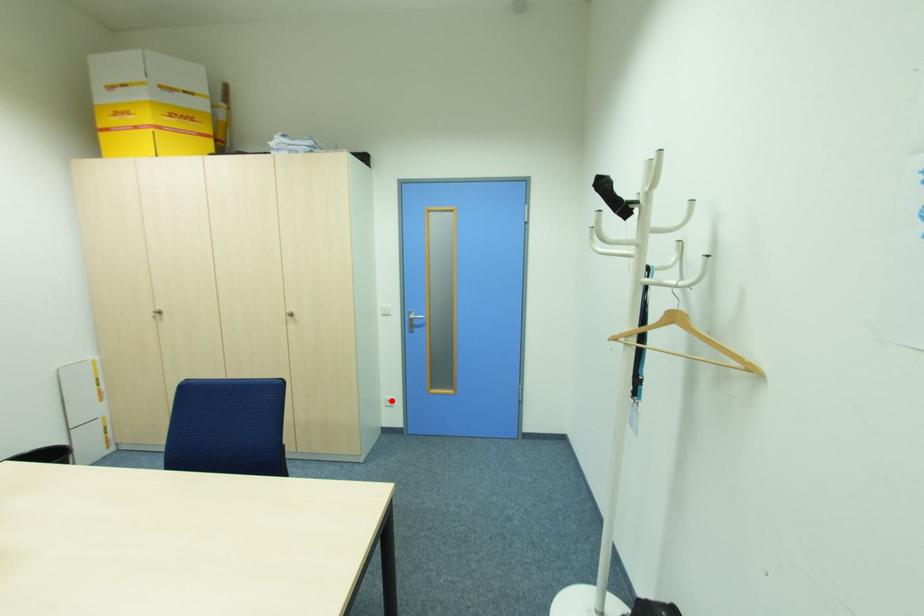
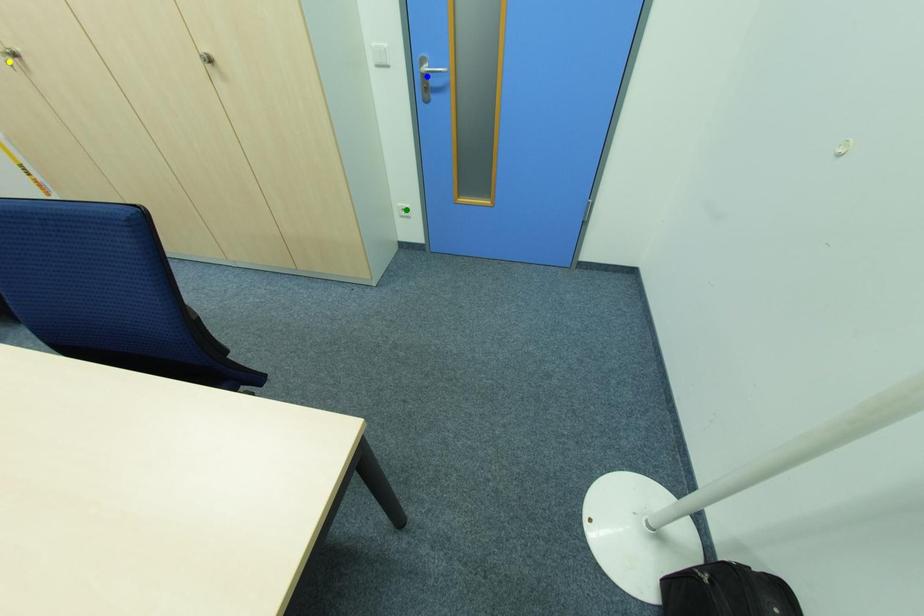
Question: I am providing you with two images of the same scene from different viewpoints. A red point is marked on the first image. You are given multiple points on the second image. In image 2, which mark is for the same physical point as the one in image 1?

Choices:
 (A) blue point
 (B) green point
 (C) yellow point

Answer: (B)